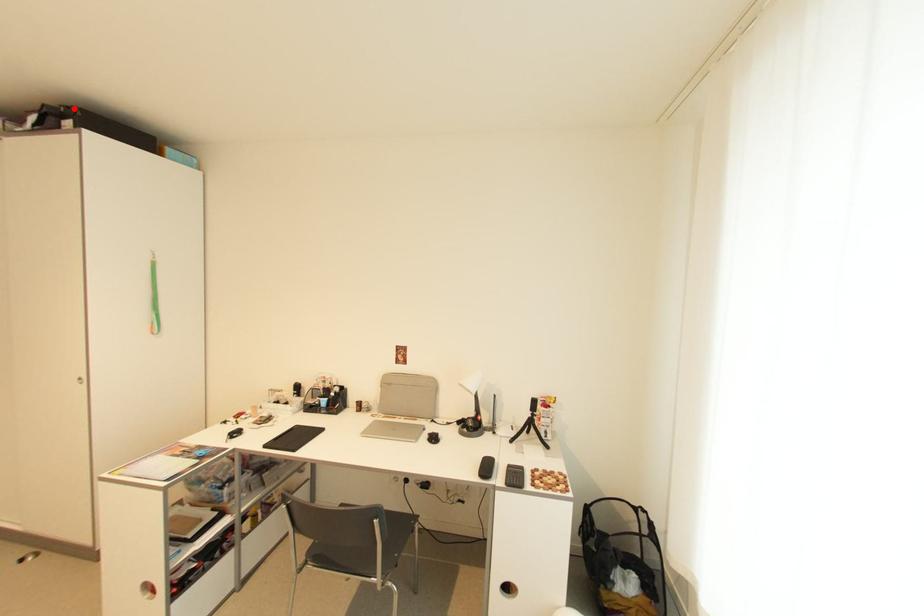
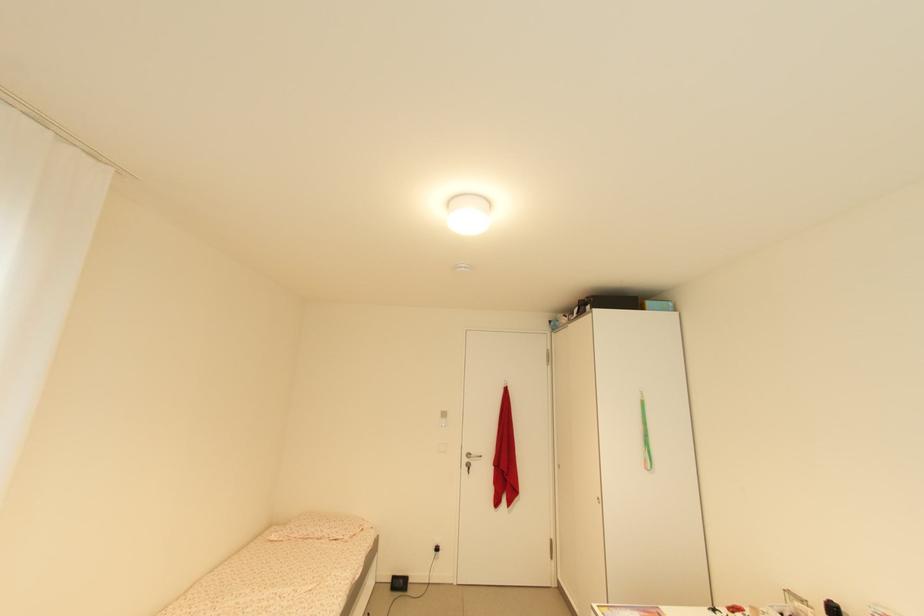
The point at the highlighted location is marked in the first image. Where is the corresponding point in the second image?

(592, 299)